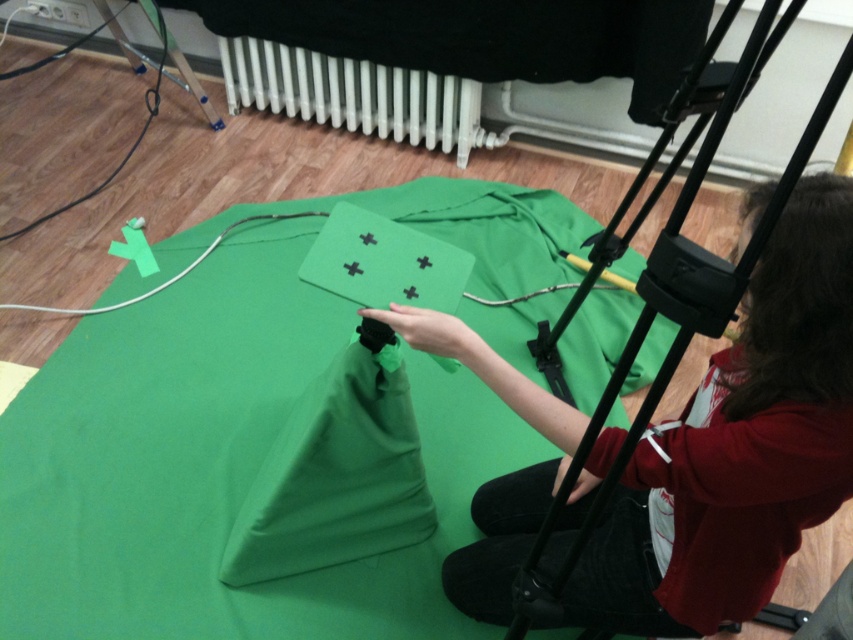
Question: Does green matte cloth at center appear under smooth green fabric at center?

Choices:
 (A) yes
 (B) no

Answer: (B)

Question: Does green matte cloth at center have a greater width compared to white plastic radiator at upper center?

Choices:
 (A) yes
 (B) no

Answer: (A)

Question: Which point appears farthest from the camera in this image?

Choices:
 (A) (622, 342)
 (B) (683, 481)
 (C) (431, 134)

Answer: (C)

Question: Estimate the real-world distances between objects in this image. Which object is closer to the green matte cloth at center?

Choices:
 (A) smooth green fabric at center
 (B) white plastic radiator at upper center

Answer: (B)

Question: Which point appears farthest from the camera in this image?

Choices:
 (A) (563, 240)
 (B) (572, 621)

Answer: (A)

Question: Is green matte cloth at center further to camera compared to smooth green fabric at center?

Choices:
 (A) no
 (B) yes

Answer: (B)